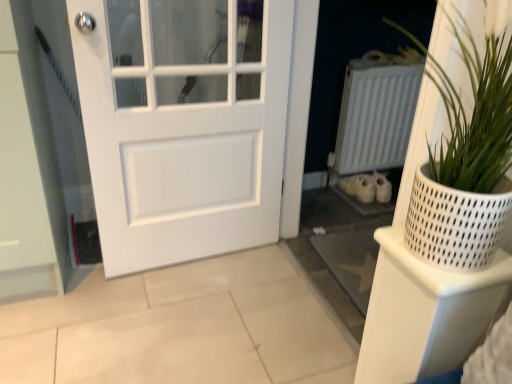
Identify the location of white matte radiator at center right. (376, 112).

What do you see at coordinates (183, 124) in the screenshot? Image resolution: width=512 pixels, height=384 pixels. I see `white matte door at center` at bounding box center [183, 124].

Where is `white matte door at center`? white matte door at center is located at coordinates (183, 124).

The height and width of the screenshot is (384, 512). Describe the element at coordinates (465, 161) in the screenshot. I see `white textured pot at right` at that location.

You are a GUI agent. You are given a task and a screenshot of the screen. Output one action in this format:
    pyautogui.click(x=<x>, y=<y>)
    Task: Click on the white matte radiator at center right
    This screenshot has height=384, width=512.
    Given the screenshot: What is the action you would take?
    pyautogui.click(x=376, y=112)

Which object is closer to the camera taking this photo, white textured pot at right or white plastic shelf at right?

white textured pot at right is closer to the camera.

Consider the image. Considering the relative positions of white textured pot at right and white plastic shelf at right in the image provided, is white textured pot at right to the left or to the right of white plastic shelf at right?

white textured pot at right is to the right of white plastic shelf at right.

Would you say white textured pot at right is inside or outside white plastic shelf at right?

white textured pot at right cannot be found inside white plastic shelf at right.

Is white textured pot at right touching white plastic shelf at right?

No, white textured pot at right is not making contact with white plastic shelf at right.

Is white plastic shelf at right oriented towards white matte radiator at center right?

No, white plastic shelf at right is not facing towards white matte radiator at center right.

Is white plastic shelf at right directly adjacent to white matte radiator at center right?

No, white plastic shelf at right is not next to white matte radiator at center right.

From a real-world perspective, who is located higher, white plastic shelf at right or white matte radiator at center right?

white matte radiator at center right, from a real-world perspective.

Which is farther, (421, 216) or (346, 78)?

Point (346, 78)

From the picture: Is the depth of white textured pot at right less than that of white matte radiator at center right?

Yes, it is.

Locate an element on the screen. The image size is (512, 384). radiator below the white textured pot at right (from a real-world perspective) is located at coordinates 376,112.

In order to click on door directly beneath the white textured pot at right (from a real-world perspective) in this screenshot , I will do `click(183, 124)`.

Is point (442, 145) less distant than point (172, 83)?

That is True.

Between white textured pot at right and white matte door at center, which one appears on the left side from the viewer's perspective?

Positioned to the left is white matte door at center.

Can you see white textured pot at right touching white matte door at center?

white textured pot at right and white matte door at center are clearly separated.

Considering the sizes of white matte radiator at center right and white textured pot at right in the image, is white matte radiator at center right wider or thinner than white textured pot at right?

Considering their sizes, white matte radiator at center right looks slimmer than white textured pot at right.

Based on the photo, does white matte radiator at center right have a smaller size compared to white textured pot at right?

No, white matte radiator at center right is not smaller than white textured pot at right.

Are white matte radiator at center right and white textured pot at right far apart?

Absolutely, white matte radiator at center right is distant from white textured pot at right.

Looking at this image, from the image's perspective, which is above, white matte radiator at center right or white textured pot at right?

white matte radiator at center right.

From a real-world perspective, is white matte door at center beneath white matte radiator at center right?

No, from a real-world perspective, white matte door at center is not under white matte radiator at center right.

Would you say white matte door at center is inside or outside white matte radiator at center right?

white matte door at center is outside white matte radiator at center right.

How many degrees apart are the facing directions of white matte door at center and white matte radiator at center right?

The angular difference between white matte door at center and white matte radiator at center right is 1.62 degrees.

Which is closer, (x=249, y=106) or (x=377, y=139)?

The point (x=249, y=106) is in front.

How different are the orientations of white plastic shelf at right and white matte door at center in degrees?

They differ by 94.8 degrees in their facing directions.

Considering the sizes of objects white plastic shelf at right and white matte door at center in the image provided, who is shorter, white plastic shelf at right or white matte door at center?

Standing shorter between the two is white plastic shelf at right.

Which is nearer, (482, 311) or (209, 118)?

The point (482, 311) is in front.

This screenshot has width=512, height=384. Find the location of `door above the white plastic shelf at right (from the image's perspective)`. door above the white plastic shelf at right (from the image's perspective) is located at coordinates (183, 124).

At what (x,y) coordinates should I click in order to perform the action: click on shelf that appears below the white textured pot at right (from a real-world perspective). Please return your answer as a coordinate pair (x, y). The width and height of the screenshot is (512, 384). Looking at the image, I should click on (424, 313).

What are the coordinates of `radiator on the right of white plastic shelf at right` in the screenshot? It's located at (376, 112).

Looking at the image, which one is located further to white matte radiator at center right, white matte door at center or white plastic shelf at right?

The object further to white matte radiator at center right is white plastic shelf at right.

Looking at this image, which object lies nearer to the anchor point white matte radiator at center right, white plastic shelf at right or white matte door at center?

Based on the image, white matte door at center appears to be nearer to white matte radiator at center right.

Which object lies further to the anchor point white plastic shelf at right, white textured pot at right or white matte radiator at center right?

Among the two, white matte radiator at center right is located further to white plastic shelf at right.

In the scene shown: Considering their positions, is white plastic shelf at right positioned further to white textured pot at right than white matte radiator at center right?

The object further to white textured pot at right is white matte radiator at center right.

Which object lies further to the anchor point white matte radiator at center right, white plastic shelf at right or white textured pot at right?

The object further to white matte radiator at center right is white plastic shelf at right.

Which object lies further to the anchor point white matte door at center, white matte radiator at center right or white plastic shelf at right?

Among the two, white plastic shelf at right is located further to white matte door at center.

Estimate the real-world distances between objects in this image. Which object is closer to white plastic shelf at right, white matte door at center or white matte radiator at center right?

white matte door at center.

Consider the image. From the image, which object appears to be nearer to white plastic shelf at right, white matte radiator at center right or white textured pot at right?

The object closer to white plastic shelf at right is white textured pot at right.

What are the coordinates of `door between white plastic shelf at right and white matte radiator at center right from front to back` in the screenshot? It's located at (183, 124).

Where is `shelf located between white textured pot at right and white matte radiator at center right in the depth direction`? The image size is (512, 384). shelf located between white textured pot at right and white matte radiator at center right in the depth direction is located at coordinates [x=424, y=313].

Locate an element on the screen. shelf located between white textured pot at right and white matte door at center in the depth direction is located at coordinates (424, 313).

At what (x,y) coordinates should I click in order to perform the action: click on door between white textured pot at right and white matte radiator at center right from front to back. Please return your answer as a coordinate pair (x, y). Looking at the image, I should click on (183, 124).